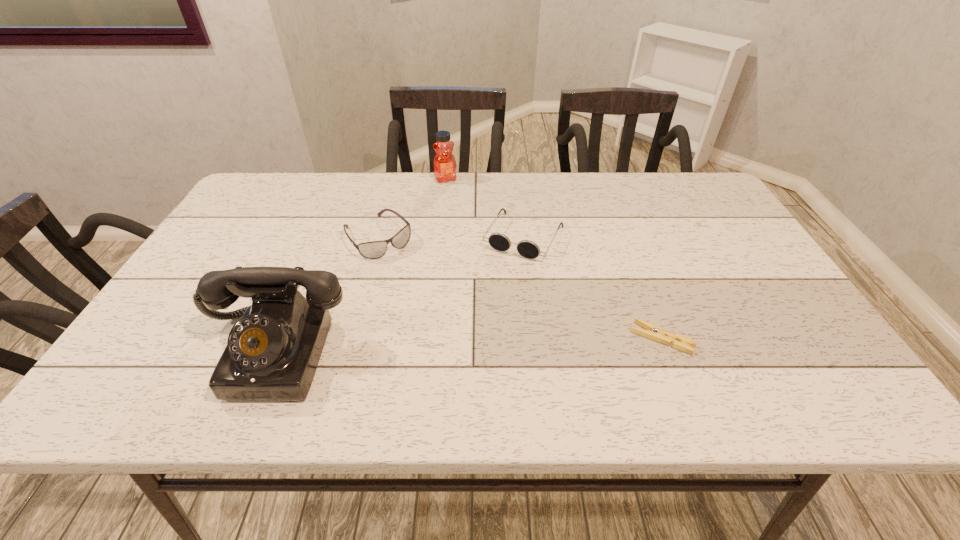
At what (x,y) coordinates should I click in order to perform the action: click on clothespin at the near edge. Please return your answer as a coordinate pair (x, y). Image resolution: width=960 pixels, height=540 pixels. Looking at the image, I should click on (656, 333).

Locate an element on the screen. Image resolution: width=960 pixels, height=540 pixels. object located at the left edge is located at coordinates (272, 353).

The width and height of the screenshot is (960, 540). Find the location of `object at the near left corner`. object at the near left corner is located at coordinates (272, 353).

The image size is (960, 540). In order to click on free space at the far edge of the desktop in this screenshot , I will do coord(649,208).

This screenshot has width=960, height=540. Identify the location of free space at the near edge of the desktop. (628, 349).

Locate an element on the screen. The height and width of the screenshot is (540, 960). vacant region at the left edge of the desktop is located at coordinates (246, 219).

At what (x,y) coordinates should I click in order to perform the action: click on vacant space at the right edge of the desktop. Please return your answer as a coordinate pair (x, y). Looking at the image, I should click on (770, 315).

The width and height of the screenshot is (960, 540). Find the location of `free space at the far left corner`. free space at the far left corner is located at coordinates (258, 207).

Locate an element on the screen. The width and height of the screenshot is (960, 540). vacant space at the far right corner of the desktop is located at coordinates (684, 204).

In order to click on blank space at the near right corner of the desktop in this screenshot , I will do `click(756, 336)`.